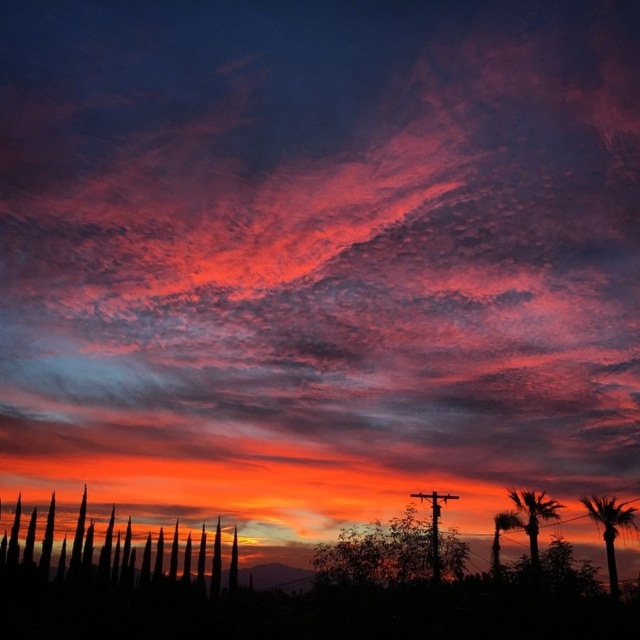
Does green leafy tree at center have a greater height compared to silky brown palm tree at right?

Incorrect, green leafy tree at center's height is not larger of silky brown palm tree at right's.

What do you see at coordinates (390, 552) in the screenshot?
I see `green leafy tree at center` at bounding box center [390, 552].

Between point (369, 528) and point (612, 552), which one is positioned behind?

The point (369, 528) is behind.

Locate an element on the screen. Image resolution: width=640 pixels, height=640 pixels. green leafy tree at center is located at coordinates (390, 552).

Is silky black trees at lower left to the right of green leafy palm tree at center-right from the viewer's perspective?

Incorrect, silky black trees at lower left is not on the right side of green leafy palm tree at center-right.

Is silky black trees at lower left shorter than green leafy palm tree at center-right?

No.

The height and width of the screenshot is (640, 640). Describe the element at coordinates (120, 556) in the screenshot. I see `silky black trees at lower left` at that location.

I want to click on silky black trees at lower left, so click(x=120, y=556).

Who is more distant from viewer, (96,577) or (458,545)?

The point (96,577) is more distant.

Is point (3, 554) less distant than point (429, 531)?

No, (3, 554) is further to viewer.

Which is behind, point (168, 570) or point (401, 538)?

The point (168, 570) is behind.

Locate an element on the screen. silky black trees at lower left is located at coordinates (120, 556).